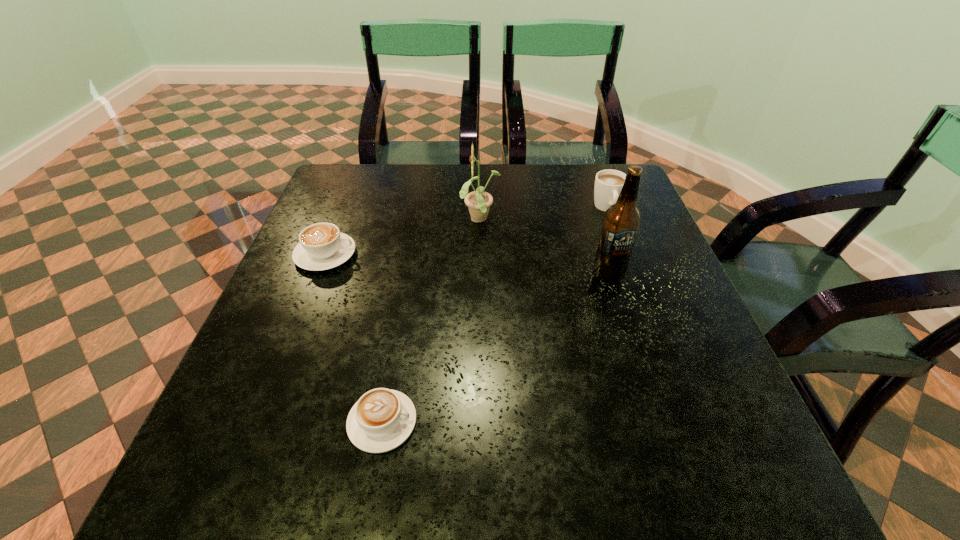
Locate an element on the screen. This screenshot has height=540, width=960. beer bottle located at the right edge is located at coordinates (622, 220).

What are the coordinates of `cappuccino at the right edge` in the screenshot? It's located at click(x=608, y=183).

Locate an element on the screen. object located in the far right corner section of the desktop is located at coordinates (608, 183).

Image resolution: width=960 pixels, height=540 pixels. Identify the location of free spot at the far edge of the desktop. (418, 172).

Identify the location of free space at the left edge. The image size is (960, 540). (267, 323).

You are a GUI agent. You are given a task and a screenshot of the screen. Output one action in this format:
    pyautogui.click(x=<x>, y=<y>)
    Task: Click on the vacant space at the right edge of the desktop
    This screenshot has width=960, height=540.
    Given the screenshot: What is the action you would take?
    pyautogui.click(x=734, y=431)

This screenshot has height=540, width=960. Find the location of `free region at the far left corner of the desktop`. free region at the far left corner of the desktop is located at coordinates (375, 185).

The height and width of the screenshot is (540, 960). In the image, there is a desktop. Find the location of `free region at the near left corner`. free region at the near left corner is located at coordinates (287, 480).

What are the coordinates of `free location at the far right corner` in the screenshot? It's located at (637, 195).

Find the location of a particular element. The image size is (960, 540). vacant space that's between the third object from left to right and the nearest object is located at coordinates [431, 321].